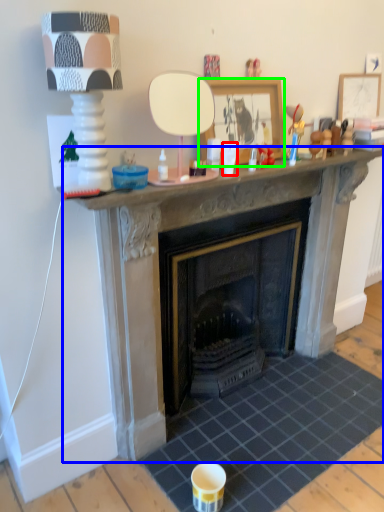
Question: Which is farther away from coffee cup (highlighted by a red box)? fireplace (highlighted by a blue box) or picture frame (highlighted by a green box)?

Choices:
 (A) fireplace
 (B) picture frame

Answer: (A)